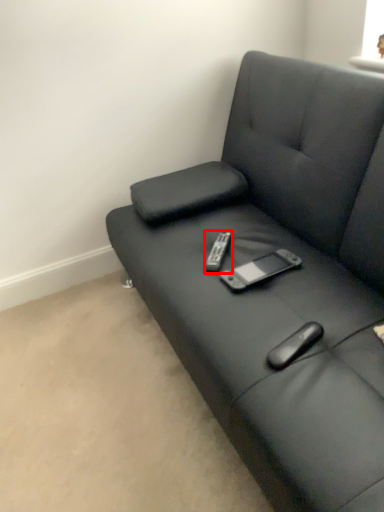
Question: From the image's perspective, what is the correct spatial positioning of remote (annotated by the red box) in reference to studio couch?

Choices:
 (A) below
 (B) above

Answer: (A)